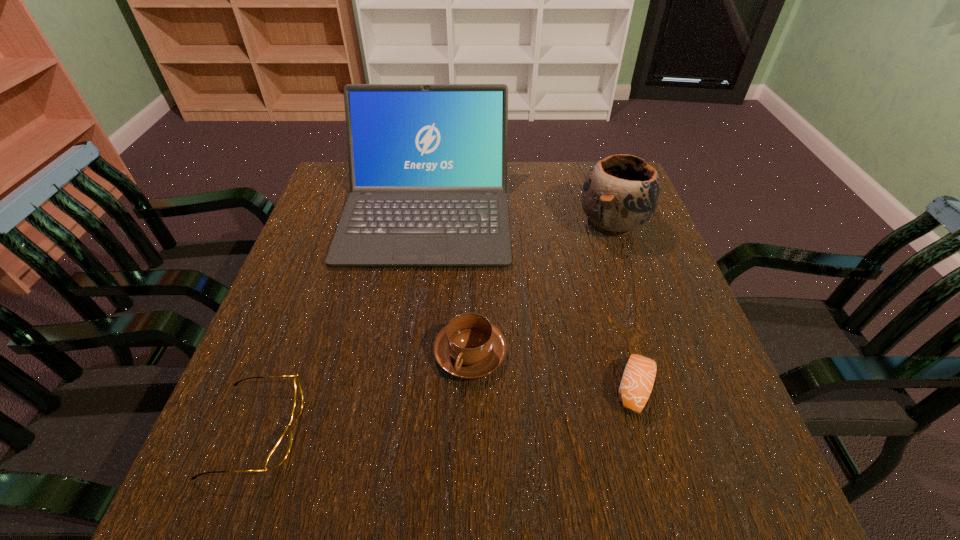
The image size is (960, 540). In order to click on laptop computer in this screenshot , I will do `click(427, 162)`.

You are a GUI agent. You are given a task and a screenshot of the screen. Output one action in this format:
    pyautogui.click(x=<x>, y=<y>)
    Task: Click on the fourth shortest object
    The image size is (960, 540).
    Given the screenshot: What is the action you would take?
    pyautogui.click(x=621, y=192)

Where is `cappuccino`? cappuccino is located at coordinates 469,347.

Where is `spectacles`? spectacles is located at coordinates (278, 454).

Image resolution: width=960 pixels, height=540 pixels. I want to click on sushi, so click(x=638, y=378).

At what (x,y) coordinates should I click in order to perform the action: click on vacant space located on the screen of the laptop computer. Please return your answer as a coordinate pair (x, y). Looking at the image, I should click on (397, 418).

I want to click on free space located 0.100m on the left of the pottery, so click(540, 223).

Identify the location of vacant position located on the side of the third tallest object with the handle. (467, 518).

You are a GUI agent. You are given a task and a screenshot of the screen. Output one action in this format:
    pyautogui.click(x=<x>, y=<y>)
    Task: Click on the vacant space located 0.350m on the front-facing side of the spectacles
    The width and height of the screenshot is (960, 540).
    Given the screenshot: What is the action you would take?
    pyautogui.click(x=501, y=430)

Image resolution: width=960 pixels, height=540 pixels. Identify the location of vacant region located 0.340m on the back of the sushi. (595, 247).